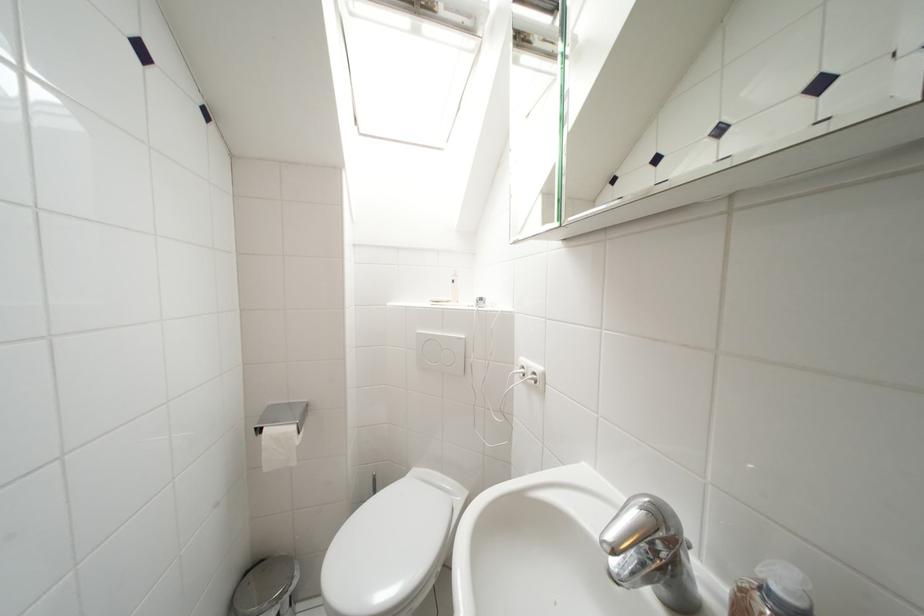
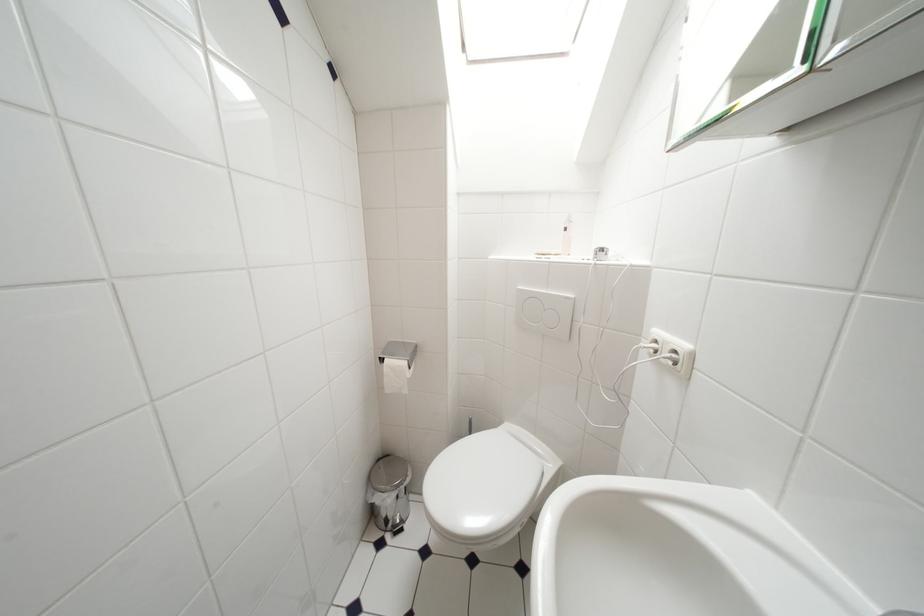
Question: The camera is either moving clockwise (left) or counter-clockwise (right) around the object. The first image is from the beginning of the video and the second image is from the end. Is the camera moving left or right when shooting the video?

Choices:
 (A) Left
 (B) Right

Answer: (B)